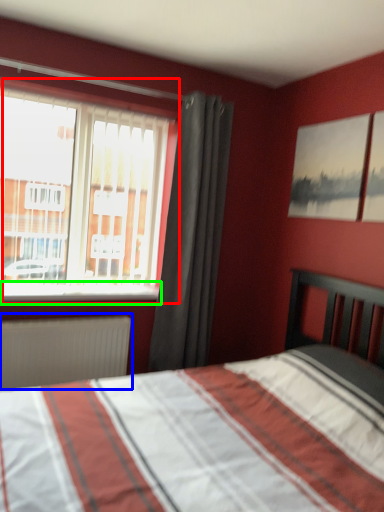
Question: Considering the real-world distances, which object is farthest from window (highlighted by a red box)? radiator (highlighted by a blue box) or window sill (highlighted by a green box)?

Choices:
 (A) radiator
 (B) window sill

Answer: (A)